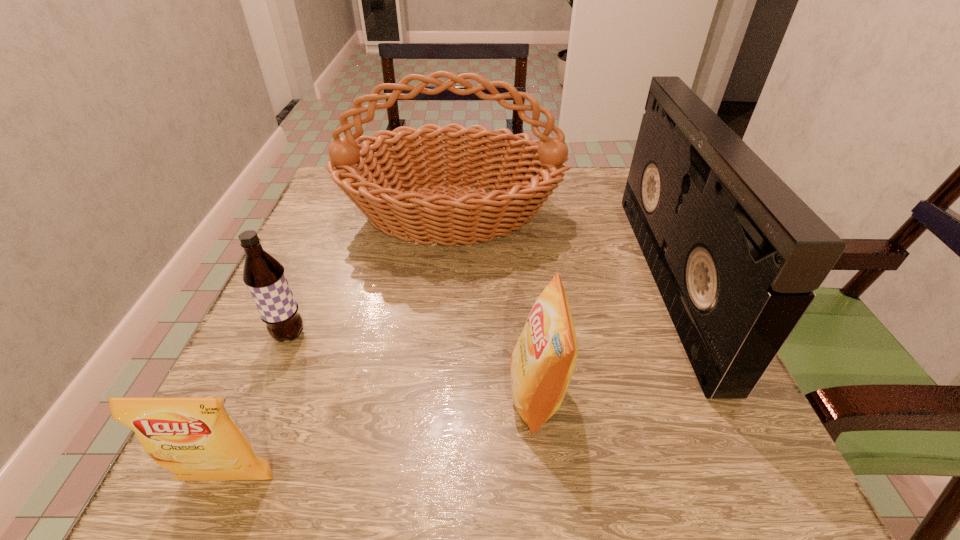
The height and width of the screenshot is (540, 960). What are the coordinates of `vacant position located on the back of the root beer` in the screenshot? It's located at (341, 212).

You are a GUI agent. You are given a task and a screenshot of the screen. Output one action in this format:
    pyautogui.click(x=<x>, y=<y>)
    Task: Click on the blank area located on the front-facing side of the farther crisp (potato chip)
    
    Given the screenshot: What is the action you would take?
    pyautogui.click(x=399, y=393)

Locate an element on the screen. This screenshot has width=960, height=540. free location located on the front-facing side of the farther crisp (potato chip) is located at coordinates (340, 393).

Locate an element on the screen. free location located 0.300m on the front-facing side of the farther crisp (potato chip) is located at coordinates (314, 393).

Locate an element on the screen. This screenshot has width=960, height=540. basket positioned at the far edge is located at coordinates [x=395, y=197].

The width and height of the screenshot is (960, 540). In order to click on videotape located at the far edge in this screenshot , I will do `click(736, 254)`.

Find the location of a particular element. This screenshot has height=540, width=960. object located at the near edge is located at coordinates (196, 438).

Locate an element on the screen. This screenshot has height=540, width=960. basket that is at the left edge is located at coordinates 395,197.

Image resolution: width=960 pixels, height=540 pixels. I want to click on root beer present at the left edge, so click(x=264, y=276).

This screenshot has width=960, height=540. I want to click on crisp (potato chip) positioned at the left edge, so click(x=196, y=438).